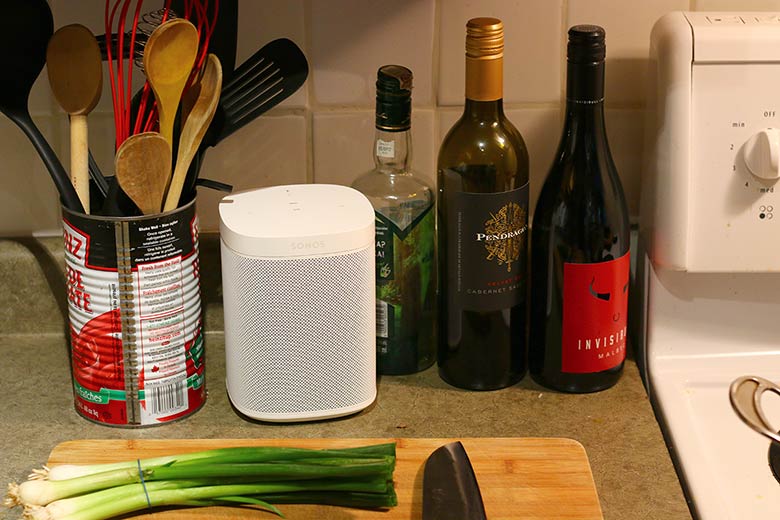
This screenshot has width=780, height=520. Find the location of `bottles`. bottles is located at coordinates (586, 235), (477, 250), (394, 249).